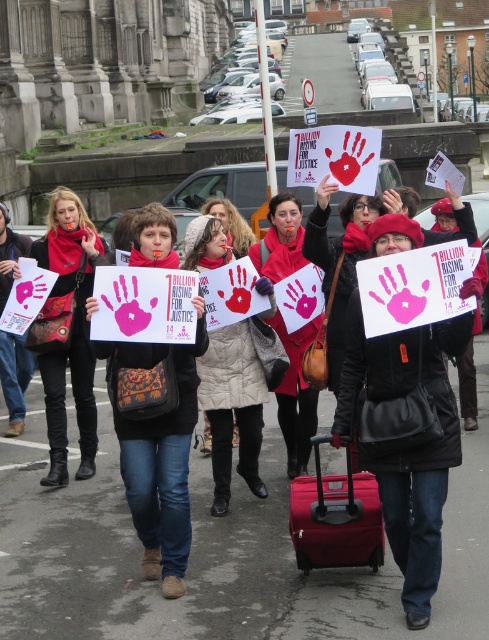
Can you confirm if matte red suitcase at lower center is taller than matte gray coat at center?

In fact, matte red suitcase at lower center may be shorter than matte gray coat at center.

Find the location of `matte red suitcase at lower center`. matte red suitcase at lower center is located at coordinates (335, 516).

Who is more forward, (298, 552) or (294, 419)?

Point (298, 552) is more forward.

You are a GUI agent. You are given a task and a screenshot of the screen. Output one action in this format:
    pyautogui.click(x=<x>, y=<y>)
    Task: Click on the matte red suitcase at lower center
    
    Given the screenshot: What is the action you would take?
    pyautogui.click(x=335, y=516)

Is beige quilted coat at center bigger than matte gray coat at center?

No.

Is point (227, 355) closer to viewer compared to point (213, 205)?

Yes.

Identify the location of beige quilted coat at center. (232, 408).